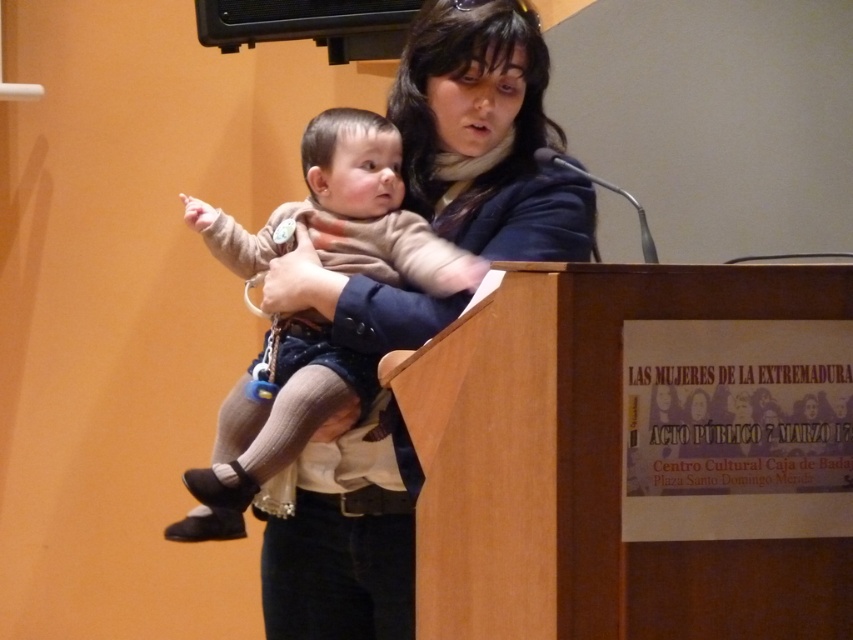
Can you confirm if matte black jacket at center is bigger than light brown knit sweater at center?

Yes, matte black jacket at center is bigger than light brown knit sweater at center.

Does matte black jacket at center have a lesser height compared to light brown knit sweater at center?

Incorrect, matte black jacket at center's height does not fall short of light brown knit sweater at center's.

Is point (514, 193) more distant than point (402, 266)?

That is False.

Where is `matte black jacket at center`? The width and height of the screenshot is (853, 640). matte black jacket at center is located at coordinates (486, 134).